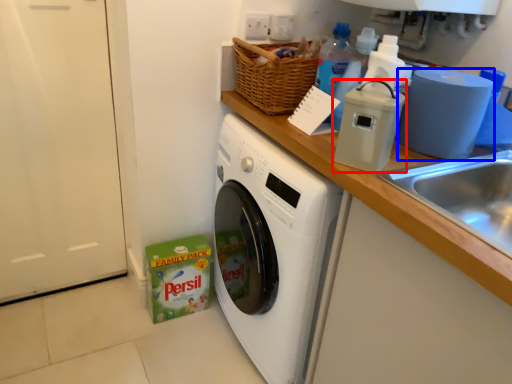
Question: Among these objects, which one is farthest to the camera, appliance (highlighted by a red box) or toilet paper (highlighted by a blue box)?

Choices:
 (A) appliance
 (B) toilet paper

Answer: (B)